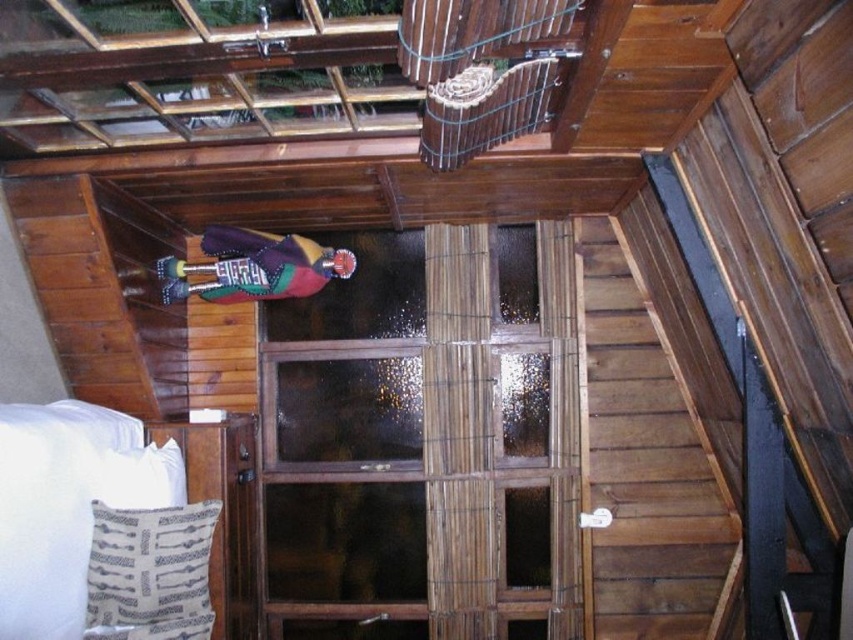
Does white soft bed at lower left have a lesser width compared to patterned fabric pillow at lower left?

Incorrect, white soft bed at lower left's width is not less than patterned fabric pillow at lower left's.

Can you confirm if white soft bed at lower left is positioned above patterned fabric pillow at lower left?

Yes, white soft bed at lower left is above patterned fabric pillow at lower left.

Between point (184, 508) and point (207, 557), which one is positioned behind?

Point (207, 557)

Identify the location of white soft bed at lower left. The image size is (853, 640). (67, 506).

Based on the photo, who is lower down, white soft bed at lower left or wooden birdcage at upper center?

white soft bed at lower left is lower down.

Does white soft bed at lower left appear over wooden birdcage at upper center?

Incorrect, white soft bed at lower left is not positioned above wooden birdcage at upper center.

What do you see at coordinates (67, 506) in the screenshot? I see `white soft bed at lower left` at bounding box center [67, 506].

Image resolution: width=853 pixels, height=640 pixels. Find the location of `white soft bed at lower left`. white soft bed at lower left is located at coordinates (67, 506).

Who is lower down, patterned fabric pillow at lower left or white fabric pillow at lower left?

patterned fabric pillow at lower left is lower down.

Does patterned fabric pillow at lower left have a larger size compared to white fabric pillow at lower left?

Indeed, patterned fabric pillow at lower left has a larger size compared to white fabric pillow at lower left.

Does point (193, 552) come farther from viewer compared to point (132, 490)?

No.

Image resolution: width=853 pixels, height=640 pixels. What are the coordinates of `patterned fabric pillow at lower left` in the screenshot? It's located at (149, 572).